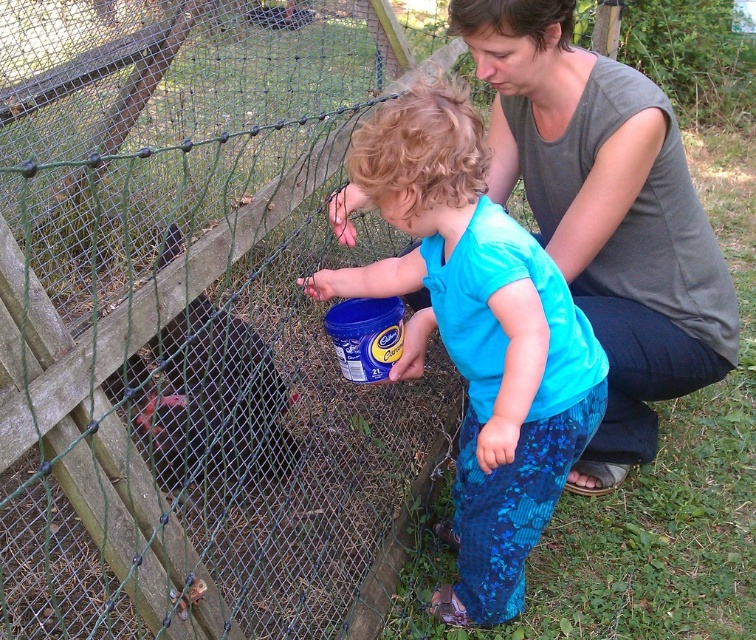
Question: Is blue matte shirt at center smaller than gray cotton shirt at upper center?

Choices:
 (A) no
 (B) yes

Answer: (B)

Question: Which object appears farthest from the camera in this image?

Choices:
 (A) gray cotton shirt at upper center
 (B) blue matte shirt at center

Answer: (A)

Question: Is blue matte shirt at center smaller than gray cotton shirt at upper center?

Choices:
 (A) yes
 (B) no

Answer: (A)

Question: Among these points, which one is nearest to the camera?

Choices:
 (A) (383, 138)
 (B) (702, 353)

Answer: (A)

Question: Does blue matte shirt at center appear on the left side of gray cotton shirt at upper center?

Choices:
 (A) no
 (B) yes

Answer: (B)